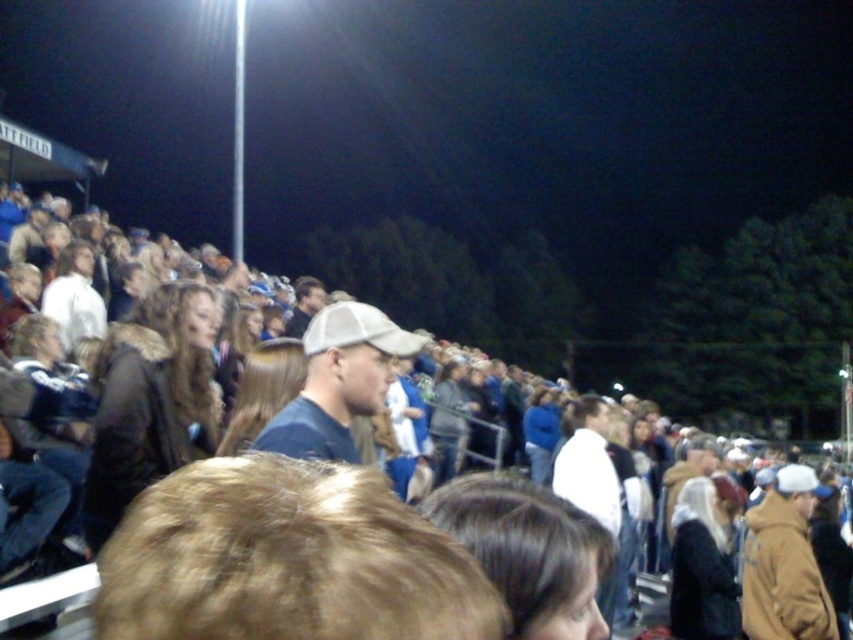
How far apart are brown fabric jacket at center and brown fuzzy jacket at right?

brown fabric jacket at center and brown fuzzy jacket at right are 9.50 feet apart from each other.

Between brown fabric jacket at center and brown fuzzy jacket at right, which one is positioned lower?

brown fuzzy jacket at right is lower down.

Is point (93, 538) farther from viewer compared to point (788, 525)?

No, it is in front of (788, 525).

The height and width of the screenshot is (640, 853). I want to click on brown fabric jacket at center, so click(x=132, y=429).

Does matte blue shirt at center appear on the left side of brown fuzzy jacket at right?

Correct, you'll find matte blue shirt at center to the left of brown fuzzy jacket at right.

Does matte blue shirt at center appear on the right side of brown fuzzy jacket at right?

No, matte blue shirt at center is not to the right of brown fuzzy jacket at right.

Locate an element on the screen. The height and width of the screenshot is (640, 853). matte blue shirt at center is located at coordinates (338, 381).

Between brown fabric jacket at center and matte blue shirt at center, which one appears on the left side from the viewer's perspective?

brown fabric jacket at center

What do you see at coordinates (132, 429) in the screenshot? I see `brown fabric jacket at center` at bounding box center [132, 429].

Locate an element on the screen. Image resolution: width=853 pixels, height=640 pixels. brown fabric jacket at center is located at coordinates (132, 429).